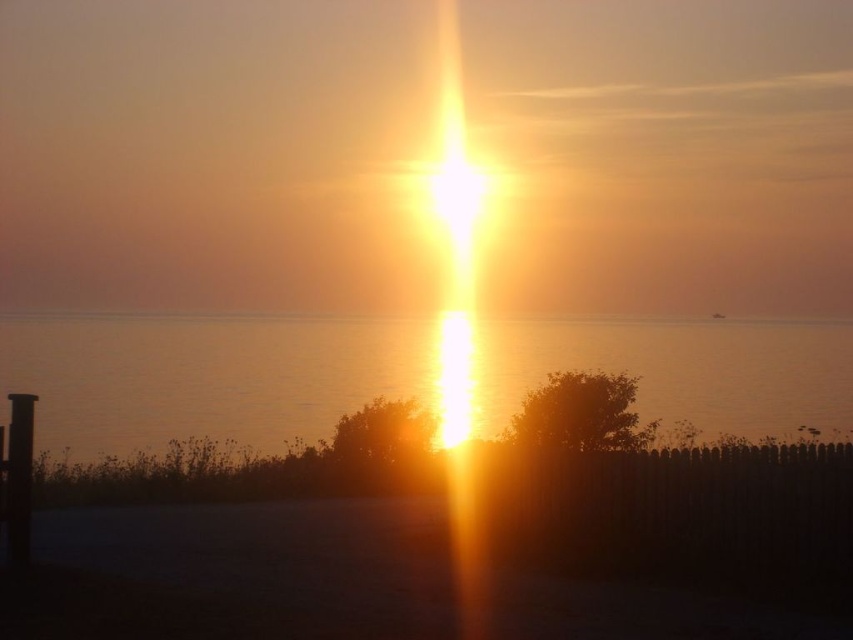
Question: Which point is closer to the camera taking this photo?

Choices:
 (A) (28, 468)
 (B) (618, 362)

Answer: (A)

Question: Considering the relative positions of silvery water at center and black matte pole at left in the image provided, where is silvery water at center located with respect to black matte pole at left?

Choices:
 (A) below
 (B) above

Answer: (A)

Question: Is silvery water at center above black matte pole at left?

Choices:
 (A) yes
 (B) no

Answer: (B)

Question: Can you confirm if silvery water at center is positioned above black matte pole at left?

Choices:
 (A) yes
 (B) no

Answer: (B)

Question: Which point is closer to the camera taking this photo?

Choices:
 (A) (171, 381)
 (B) (21, 544)

Answer: (B)

Question: Which point is closer to the camera taking this photo?

Choices:
 (A) (483, 392)
 (B) (26, 432)

Answer: (B)